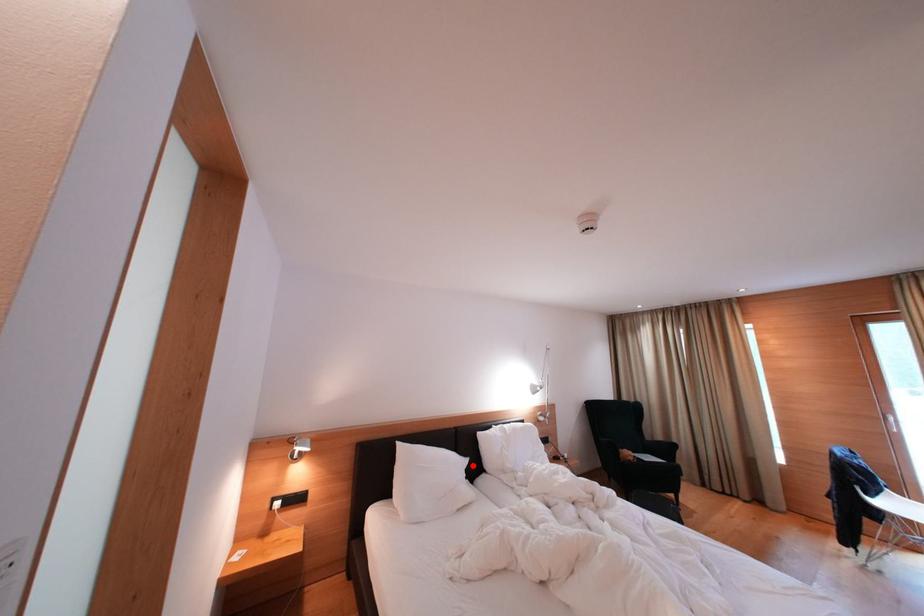
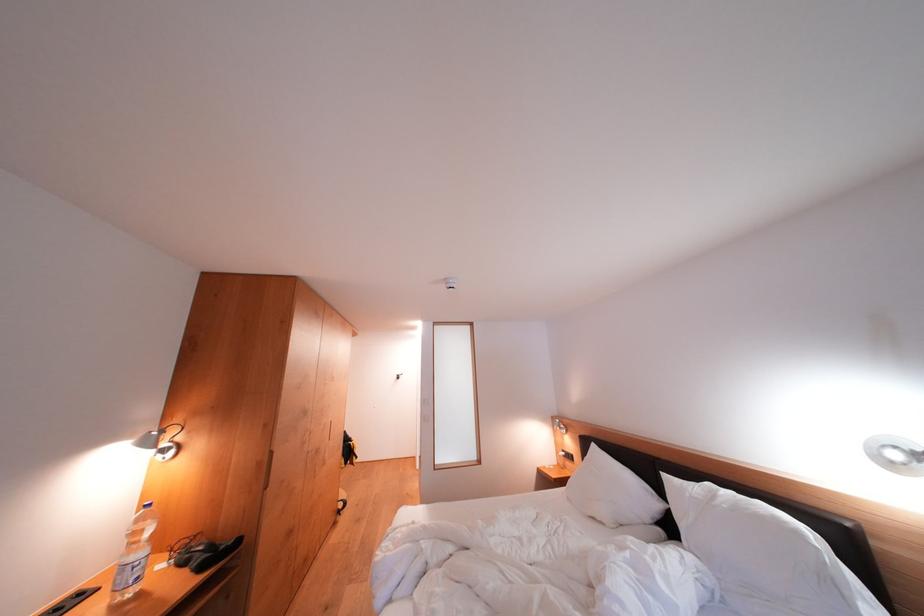
In the second image, find the point that corresponds to the highlighted location in the first image.

(664, 509)